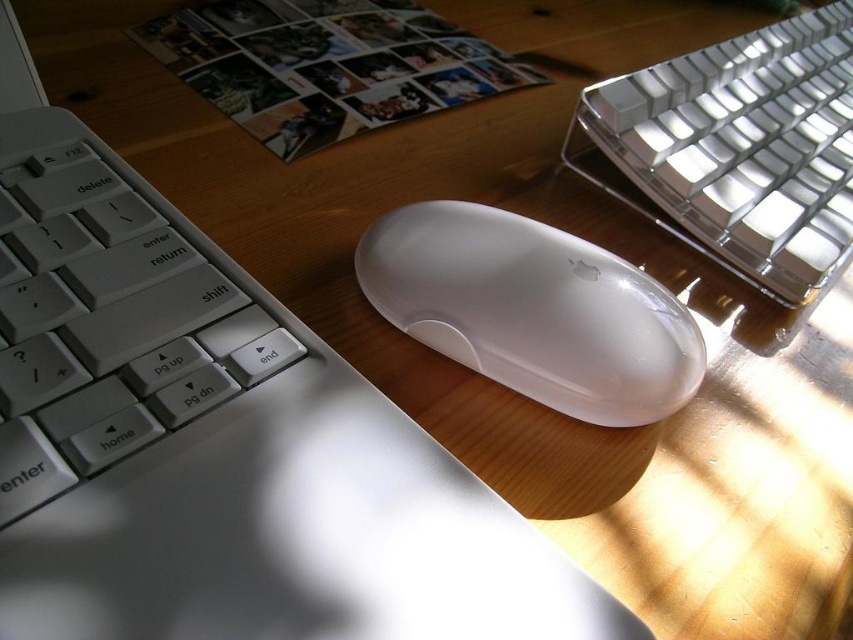
Question: Is satin silver keyboard at upper right wider than satin white mouse at center?

Choices:
 (A) no
 (B) yes

Answer: (B)

Question: Is satin silver keyboard at upper right thinner than satin white mouse at center?

Choices:
 (A) yes
 (B) no

Answer: (B)

Question: Which point is farther to the camera?

Choices:
 (A) satin silver keyboard at upper right
 (B) satin white mouse at center

Answer: (A)

Question: Is satin silver keyboard at upper right wider than satin white mouse at center?

Choices:
 (A) no
 (B) yes

Answer: (B)